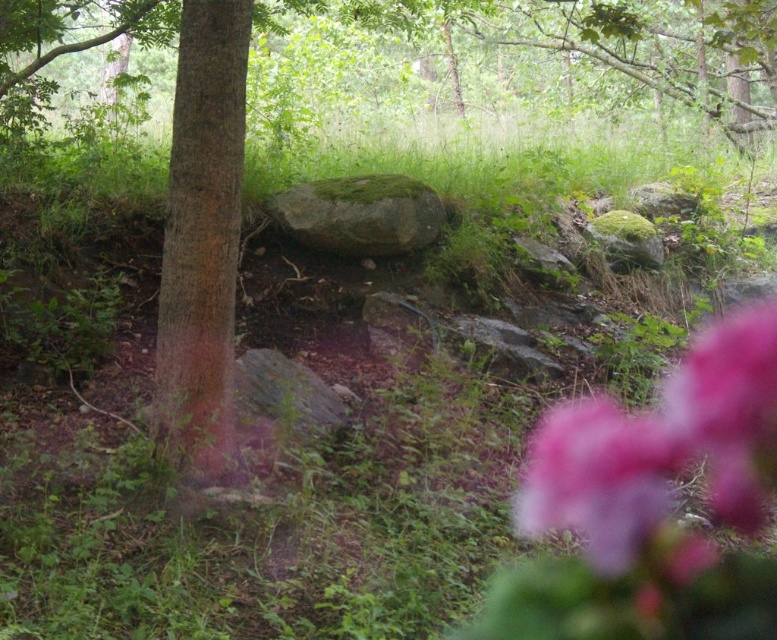
Does pink fuzzy flower at lower right appear on the left side of pink matte flower at lower right?

No, pink fuzzy flower at lower right is not to the left of pink matte flower at lower right.

Does pink fuzzy flower at lower right appear over pink matte flower at lower right?

Yes, pink fuzzy flower at lower right is above pink matte flower at lower right.

This screenshot has height=640, width=777. What are the coordinates of `pink fuzzy flower at lower right` in the screenshot? It's located at (661, 456).

At what (x,y) coordinates should I click in order to perform the action: click on pink fuzzy flower at lower right. Please return your answer as a coordinate pair (x, y). The width and height of the screenshot is (777, 640). Looking at the image, I should click on (661, 456).

Image resolution: width=777 pixels, height=640 pixels. What are the coordinates of `pink fluffy flower at lower right` in the screenshot? It's located at (730, 410).

Is point (769, 326) more distant than point (302, 230)?

Yes.

Which is behind, point (661, 392) or point (430, 204)?

The point (430, 204) is more distant.

Where is `pink fluffy flower at lower right`? Image resolution: width=777 pixels, height=640 pixels. pink fluffy flower at lower right is located at coordinates (730, 410).

Between point (598, 540) and point (685, 420), which one is positioned in front?

Point (598, 540)

Is point (539, 452) closer to viewer compared to point (730, 435)?

Yes, point (539, 452) is in front of point (730, 435).

The image size is (777, 640). What do you see at coordinates (661, 456) in the screenshot?
I see `pink fuzzy flower at lower right` at bounding box center [661, 456].

I want to click on pink fuzzy flower at lower right, so click(x=661, y=456).